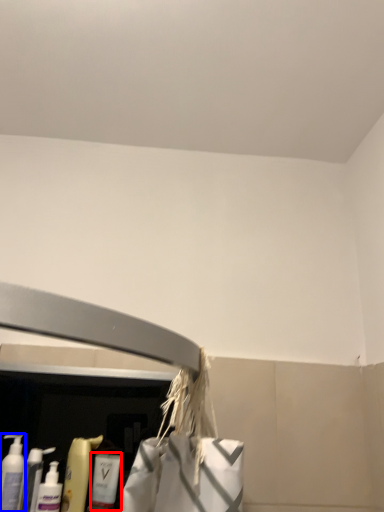
Question: Which point is further to the camera, cleaning product (highlighted by a red box) or cleaning product (highlighted by a blue box)?

Choices:
 (A) cleaning product
 (B) cleaning product

Answer: (A)